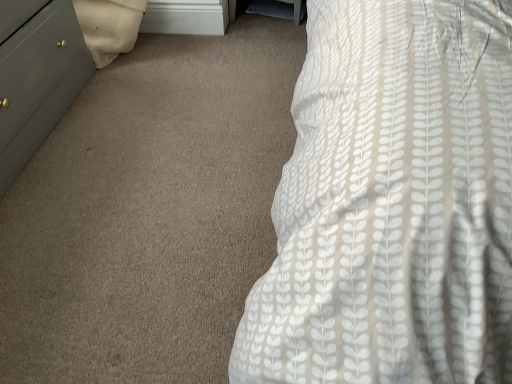
Question: Is matte gray dresser at left to the left of white matte file cabinet at upper center from the viewer's perspective?

Choices:
 (A) no
 (B) yes

Answer: (B)

Question: Does matte gray dresser at left have a greater width compared to white matte file cabinet at upper center?

Choices:
 (A) yes
 (B) no

Answer: (A)

Question: Is the position of matte gray dresser at left more distant than that of white matte file cabinet at upper center?

Choices:
 (A) yes
 (B) no

Answer: (B)

Question: Considering the relative sizes of matte gray dresser at left and white matte file cabinet at upper center in the image provided, is matte gray dresser at left taller than white matte file cabinet at upper center?

Choices:
 (A) yes
 (B) no

Answer: (A)

Question: Is white matte file cabinet at upper center inside matte gray dresser at left?

Choices:
 (A) no
 (B) yes

Answer: (A)

Question: Considering the relative sizes of matte gray dresser at left and white matte file cabinet at upper center in the image provided, is matte gray dresser at left smaller than white matte file cabinet at upper center?

Choices:
 (A) no
 (B) yes

Answer: (A)

Question: From the image's perspective, is white matte file cabinet at upper center under matte gray dresser at left?

Choices:
 (A) no
 (B) yes

Answer: (A)

Question: Does white matte file cabinet at upper center appear on the right side of matte gray dresser at left?

Choices:
 (A) yes
 (B) no

Answer: (A)

Question: Does white matte file cabinet at upper center appear on the left side of matte gray dresser at left?

Choices:
 (A) no
 (B) yes

Answer: (A)

Question: Considering the relative sizes of white matte file cabinet at upper center and matte gray dresser at left in the image provided, is white matte file cabinet at upper center thinner than matte gray dresser at left?

Choices:
 (A) no
 (B) yes

Answer: (B)

Question: From a real-world perspective, is white matte file cabinet at upper center physically below matte gray dresser at left?

Choices:
 (A) no
 (B) yes

Answer: (B)

Question: Is white matte file cabinet at upper center oriented towards matte gray dresser at left?

Choices:
 (A) yes
 (B) no

Answer: (B)

Question: From a real-world perspective, is white matte file cabinet at upper center physically located above or below matte gray dresser at left?

Choices:
 (A) below
 (B) above

Answer: (A)